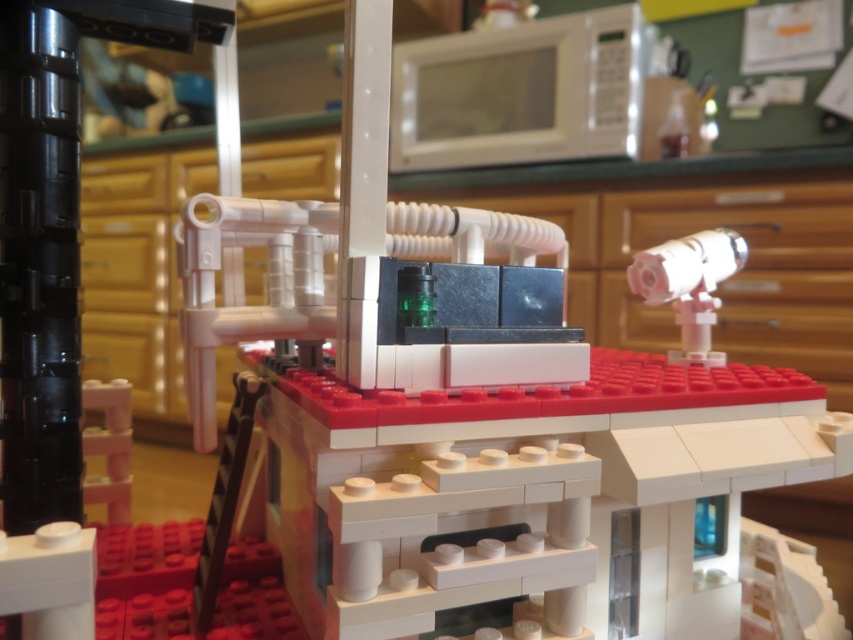
Does white glossy microwave at upper center have a smaller size compared to matte white telescope at upper right?

Incorrect, white glossy microwave at upper center is not smaller in size than matte white telescope at upper right.

The height and width of the screenshot is (640, 853). What are the coordinates of `white glossy microwave at upper center` in the screenshot? It's located at (519, 92).